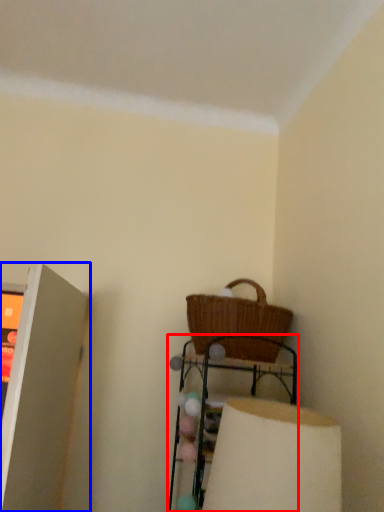
Question: Which object appears closest to the camera in this image, furniture (highlighted by a red box) or shelf (highlighted by a blue box)?

Choices:
 (A) furniture
 (B) shelf

Answer: (B)